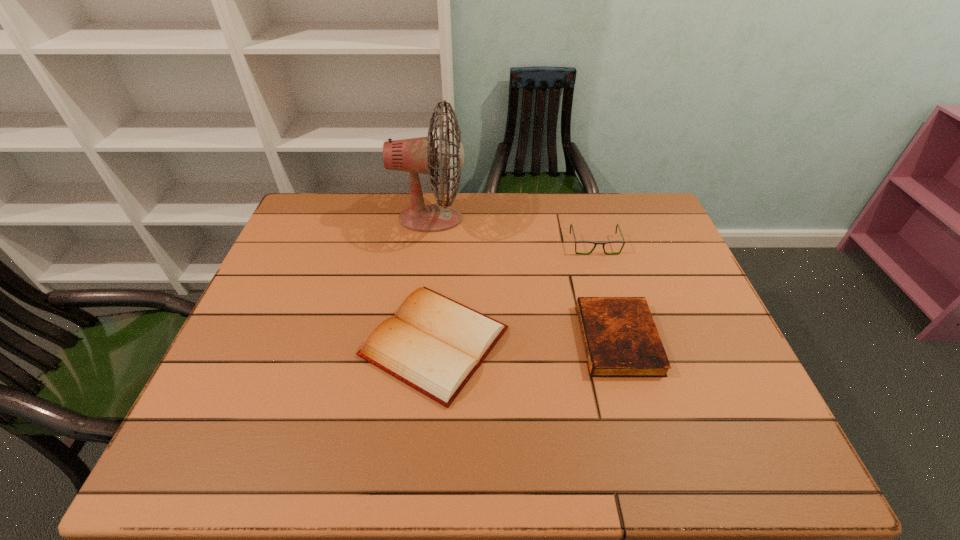
This screenshot has width=960, height=540. Find the location of `vacant region between the fan and the left Bible`. vacant region between the fan and the left Bible is located at coordinates (433, 280).

I want to click on free space between the fan and the spectacles, so click(x=513, y=232).

Where is `free space between the fan and the third shortest object`? The width and height of the screenshot is (960, 540). free space between the fan and the third shortest object is located at coordinates (513, 232).

This screenshot has width=960, height=540. Identify the location of free space between the right Bible and the fan. (524, 279).

Locate an element on the screen. This screenshot has height=540, width=960. free space between the spectacles and the fan is located at coordinates (513, 232).

Where is `unoccupied area between the tallest object and the third shortest object`? The image size is (960, 540). unoccupied area between the tallest object and the third shortest object is located at coordinates (513, 232).

This screenshot has width=960, height=540. In order to click on free space between the left Bible and the fan in this screenshot , I will do `click(433, 280)`.

Identify the location of vacant space that is in between the left Bible and the second tallest object. pyautogui.click(x=515, y=293).

Select which object is the closest to the right Bible. Please provide its 2D coordinates. Your answer should be formatted as a tuple, i.e. [(x, y)], where the tuple contains the x and y coordinates of a point satisfying the conditions above.

[(434, 344)]

Select which object appears as the second closest to the right Bible. Please provide its 2D coordinates. Your answer should be formatted as a tuple, i.e. [(x, y)], where the tuple contains the x and y coordinates of a point satisfying the conditions above.

[(582, 241)]